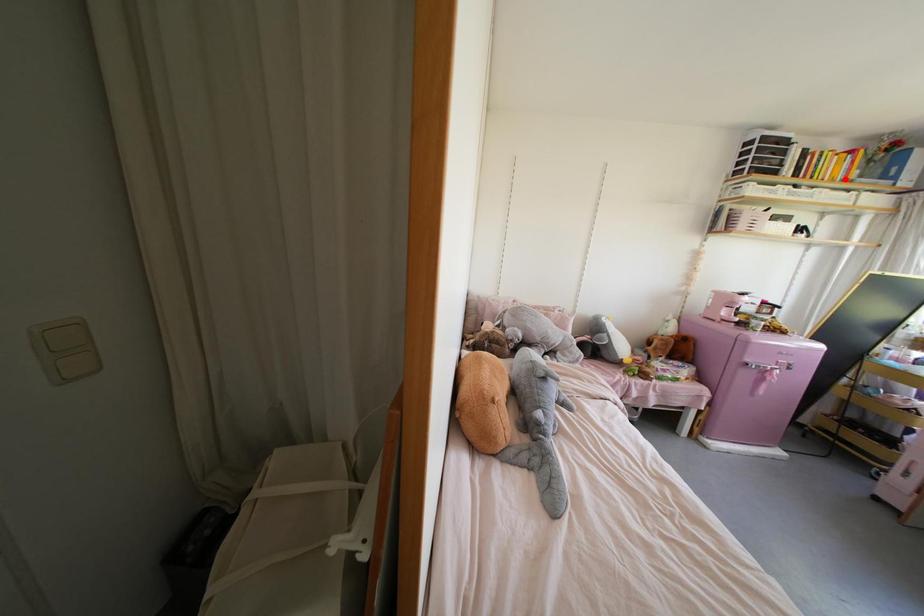
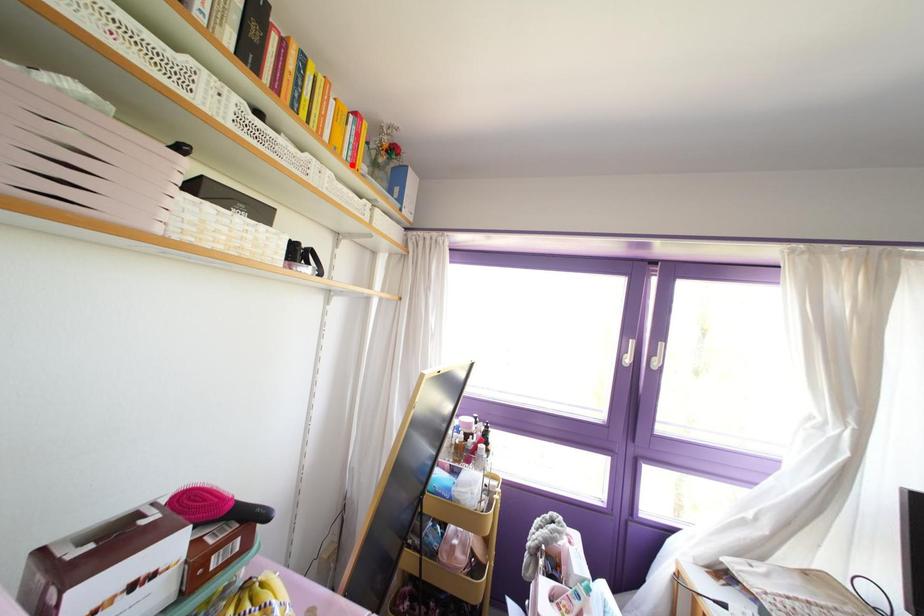
I am providing you with two images of the same scene from different viewpoints. A red point is marked on the first image and another point is marked on the second image. Does the point marked in image1 correspond to the same location as the one in image2?

Yes